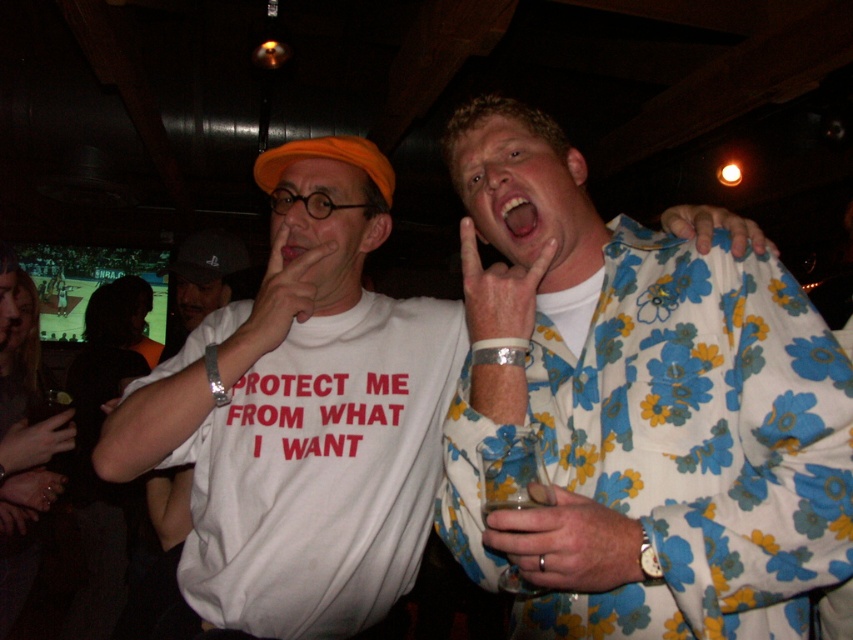
Question: Can you confirm if floral-patterned shirt at upper right is positioned below white fabric shirt at center?

Choices:
 (A) no
 (B) yes

Answer: (A)

Question: Which point appears farthest from the camera in this image?

Choices:
 (A) (755, 413)
 (B) (219, 372)

Answer: (B)

Question: Does floral-patterned shirt at upper right appear on the left side of white fabric shirt at center?

Choices:
 (A) yes
 (B) no

Answer: (B)

Question: Which object is the closest to the floral-patterned shirt at upper right?

Choices:
 (A) white fabric shirt at center
 (B) white cotton t-shirt at center

Answer: (A)

Question: Which object appears closest to the camera in this image?

Choices:
 (A) floral-patterned shirt at upper right
 (B) white fabric shirt at center

Answer: (A)

Question: Where is floral-patterned shirt at upper right located in relation to white cotton t-shirt at center in the image?

Choices:
 (A) left
 (B) right

Answer: (B)